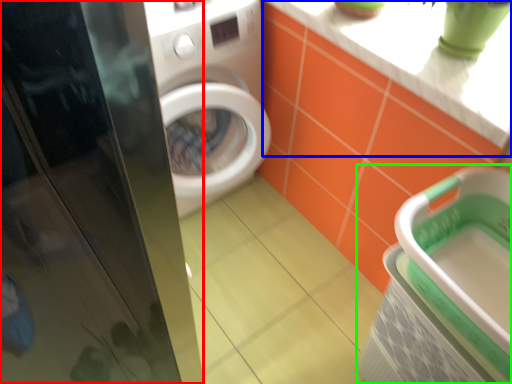
Question: Considering the real-world distances, which object is closest to screen door (highlighted by a red box)? counter top (highlighted by a blue box) or dish washer (highlighted by a green box).

Choices:
 (A) counter top
 (B) dish washer

Answer: (B)